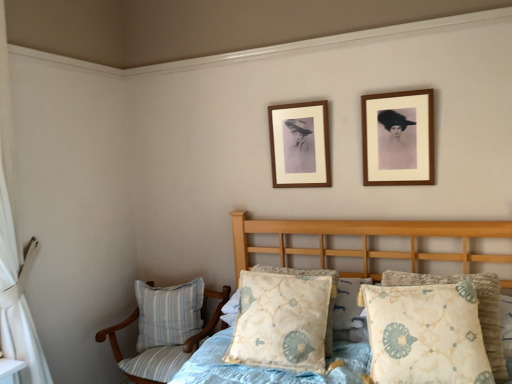
Question: Should I look upward or downward to see blue striped pillow at lower left, acting as the third pillow starting from the right?

Choices:
 (A) down
 (B) up

Answer: (A)

Question: Is striped fabric chair at lower left aimed at blue striped pillow at lower left, the 1th pillow when ordered from left to right?

Choices:
 (A) yes
 (B) no

Answer: (A)

Question: Is blue striped pillow at lower left, acting as the third pillow starting from the right, at the back of striped fabric chair at lower left?

Choices:
 (A) yes
 (B) no

Answer: (A)

Question: Can you confirm if striped fabric chair at lower left is bigger than blue striped pillow at lower left, acting as the third pillow starting from the right?

Choices:
 (A) no
 (B) yes

Answer: (B)

Question: Can you confirm if striped fabric chair at lower left is positioned to the left of blue striped pillow at lower left, the 3th pillow when ordered from front to back?

Choices:
 (A) no
 (B) yes

Answer: (A)

Question: Is the surface of striped fabric chair at lower left in direct contact with blue striped pillow at lower left, acting as the third pillow starting from the right?

Choices:
 (A) yes
 (B) no

Answer: (A)

Question: Considering the relative positions of striped fabric chair at lower left and blue striped pillow at lower left, acting as the first pillow starting from the back, in the image provided, is striped fabric chair at lower left behind blue striped pillow at lower left, acting as the first pillow starting from the back,?

Choices:
 (A) yes
 (B) no

Answer: (B)

Question: From the image's perspective, is floral-patterned fabric pillow at center, acting as the first pillow starting from the right, on wooden picture frame at upper right, positioned as the 1th picture frame in front-to-back order?

Choices:
 (A) yes
 (B) no

Answer: (B)

Question: Is floral-patterned fabric pillow at center, which appears as the first pillow when viewed from the front, at the right side of wooden picture frame at upper right, the 1th picture frame when ordered from right to left?

Choices:
 (A) no
 (B) yes

Answer: (A)

Question: Considering the relative sizes of floral-patterned fabric pillow at center, which is the third pillow in left-to-right order, and wooden picture frame at upper right, the 1th picture frame when ordered from right to left, in the image provided, is floral-patterned fabric pillow at center, which is the third pillow in left-to-right order, wider than wooden picture frame at upper right, the 1th picture frame when ordered from right to left,?

Choices:
 (A) yes
 (B) no

Answer: (A)

Question: Considering the relative sizes of floral-patterned fabric pillow at center, arranged as the third pillow when viewed from the back, and wooden picture frame at upper right, placed as the second picture frame when sorted from back to front, in the image provided, is floral-patterned fabric pillow at center, arranged as the third pillow when viewed from the back, taller than wooden picture frame at upper right, placed as the second picture frame when sorted from back to front,?

Choices:
 (A) no
 (B) yes

Answer: (B)

Question: From the image's perspective, is floral-patterned fabric pillow at center, which appears as the first pillow when viewed from the front, below wooden picture frame at upper right, which is the second picture frame from left to right?

Choices:
 (A) yes
 (B) no

Answer: (A)

Question: Is floral-patterned fabric pillow at center, arranged as the third pillow when viewed from the back, smaller than wooden picture frame at upper right, the 1th picture frame when ordered from right to left?

Choices:
 (A) no
 (B) yes

Answer: (A)

Question: Is striped fabric chair at lower left next to fluffy fabric bed at lower right?

Choices:
 (A) yes
 (B) no

Answer: (B)